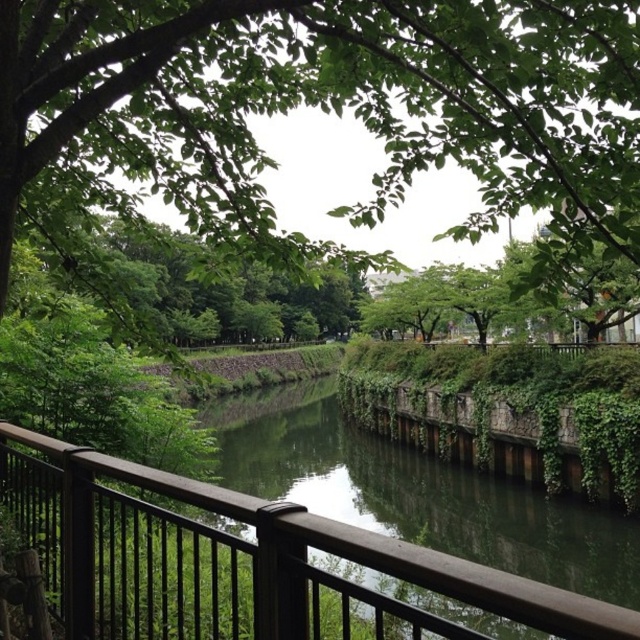
You are standing on the bridge looking at the canal. Where is the green leafy tree at upper center located in the image?

The green leafy tree at upper center is located at the 2D coordinate point of (330, 104) in the image.

You are standing on the bridge looking at the green leafy tree at upper center and the brown wooden rail at lower left. Which object is closer to you?

The brown wooden rail at lower left is behind the green leafy tree at upper center, so the green leafy tree at upper center is closer to you.